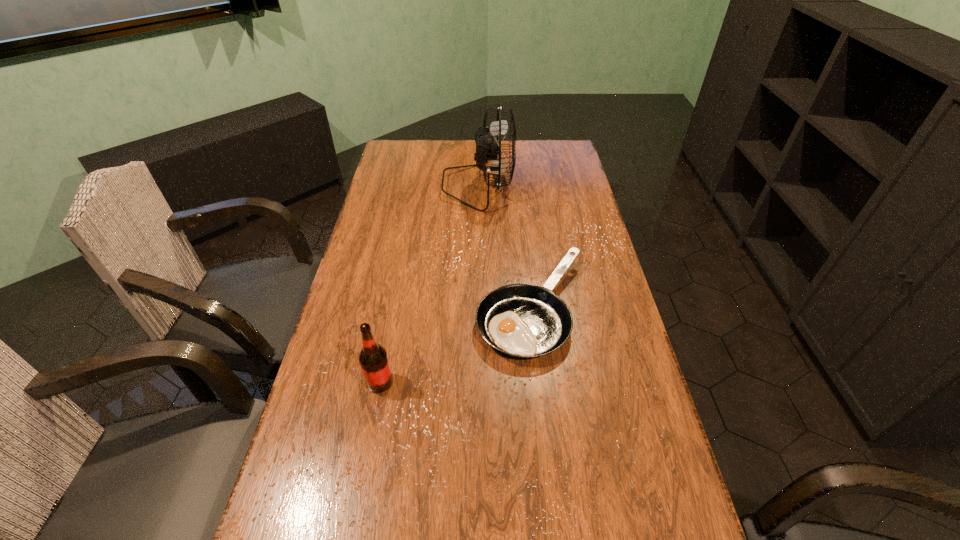
Where is `fan`? The height and width of the screenshot is (540, 960). fan is located at coordinates (488, 148).

At what (x,y) coordinates should I click in order to perform the action: click on the tallest object. Please return your answer as a coordinate pair (x, y). Looking at the image, I should click on (488, 148).

Where is `the nearest object`? the nearest object is located at coordinates (373, 358).

Locate an element on the screen. This screenshot has height=540, width=960. root beer is located at coordinates (373, 358).

You are a GUI agent. You are given a task and a screenshot of the screen. Output one action in this format:
    pyautogui.click(x=<x>, y=<y>)
    Task: Click on the frying pan
    Image resolution: width=960 pixels, height=540 pixels.
    Given the screenshot: What is the action you would take?
    pyautogui.click(x=523, y=320)

Identify the location of the shortest object. Image resolution: width=960 pixels, height=540 pixels. (523, 320).

This screenshot has width=960, height=540. Identify the location of vacant space located 0.160m in front of the farthest object, directing airflow. [553, 186].

Locate an element on the screen. The image size is (960, 540). vacant space located 0.300m on the front of the second shortest object is located at coordinates (352, 530).

Locate an element on the screen. Image resolution: width=960 pixels, height=540 pixels. blank space located 0.140m on the left of the shortest object is located at coordinates pyautogui.click(x=427, y=308).

The width and height of the screenshot is (960, 540). I want to click on object that is at the far edge, so click(x=488, y=148).